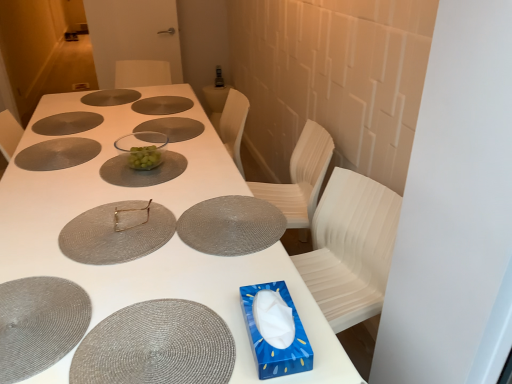
Identify the location of vacant area that lies between matte gray glass plate at upper left, which is counted as the 7th glass plate, starting from the front, and transparent glass bowl at center, acting as the sixth glass plate starting from the back. (92, 139).